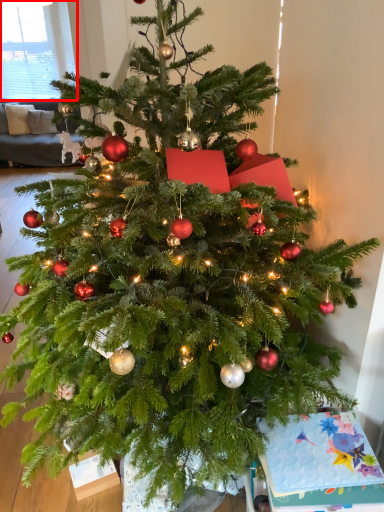
Question: From the image's perspective, considering the relative positions of window screen (annotated by the red box) and christmas card in the image provided, where is window screen (annotated by the red box) located with respect to the staircase?

Choices:
 (A) above
 (B) below

Answer: (A)